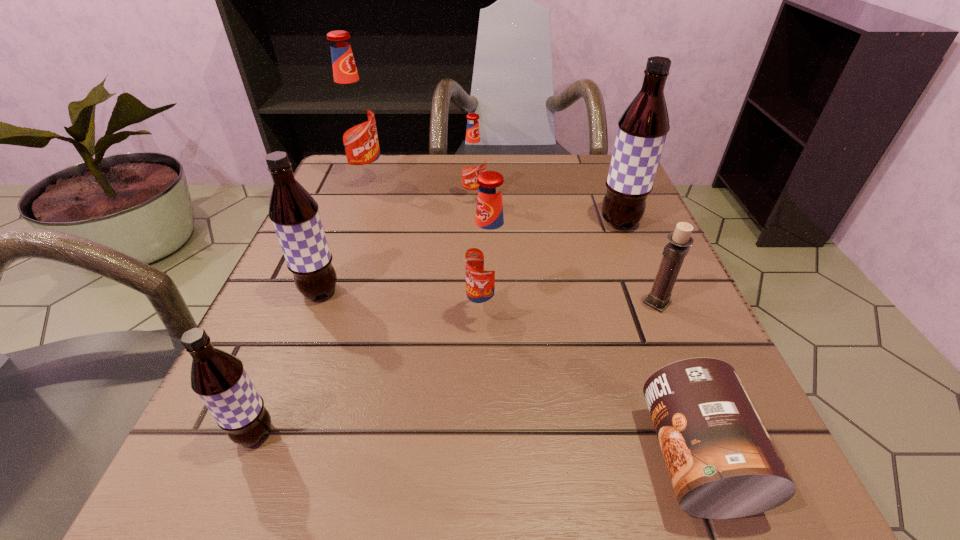
Locate an element on the screen. The image size is (960, 540). object positioned at the near right corner is located at coordinates (723, 464).

I want to click on free point at the far edge, so click(533, 184).

In order to click on free space at the near edge of the desktop in this screenshot , I will do `click(461, 444)`.

Where is `blank space at the left edge of the desktop`? Image resolution: width=960 pixels, height=540 pixels. blank space at the left edge of the desktop is located at coordinates 261,334.

The height and width of the screenshot is (540, 960). Identify the location of free location at the right edge. (699, 327).

In the image, there is a desktop. At what (x,y) coordinates should I click in order to perform the action: click on vacant space at the far left corner. Please return your answer as a coordinate pair (x, y). Looking at the image, I should click on (357, 195).

Identify the location of free space at the near left corner of the desktop. (275, 487).

In the image, there is a desktop. Identify the location of vacant space at the far right corner. Image resolution: width=960 pixels, height=540 pixels. (592, 182).

You are a GUI agent. You are given a task and a screenshot of the screen. Output one action in this format:
    pyautogui.click(x=<x>, y=<y>)
    Task: Click on the vacant area between the smallest brown root beer and the can
    The width and height of the screenshot is (960, 540).
    Given the screenshot: What is the action you would take?
    pyautogui.click(x=475, y=446)

The height and width of the screenshot is (540, 960). I want to click on free spot between the can and the smallest brown root beer, so click(x=475, y=446).